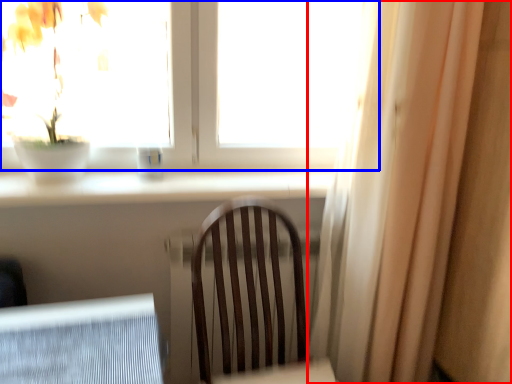
Question: Which point is further to the camera, curtain (highlighted by a red box) or window (highlighted by a blue box)?

Choices:
 (A) curtain
 (B) window

Answer: (B)